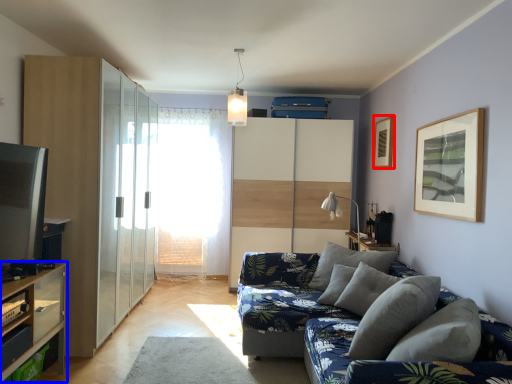
Question: Which object appears farthest to the camera in this image, picture frame (highlighted by a red box) or shelf (highlighted by a blue box)?

Choices:
 (A) picture frame
 (B) shelf

Answer: (A)